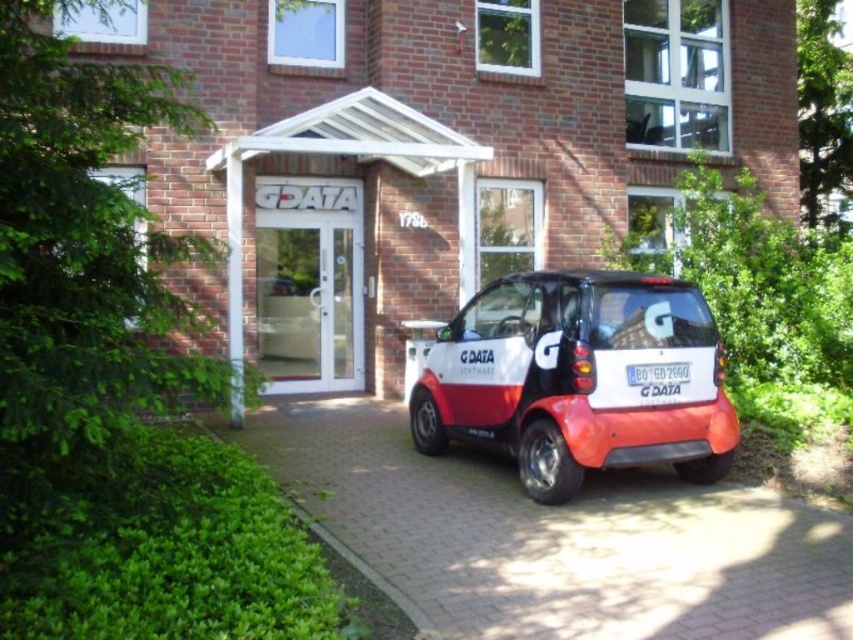
You are a delivery person trying to enter the building. You see the white glass door at center and the white plastic license plate at center. Which one is above the other?

The white glass door at center is positioned over the white plastic license plate at center, meaning the door is above the license plate.

You are a delivery person trying to park your van next to the matte white and red car at center. The van is 5 meters long. The white plastic license plate at center is attached to a pole that is 2 meters away from the car. Can you park your van here without overlapping the license plate pole?

The matte white and red car at center is in front of the white plastic license plate at center, meaning the car is closer to you than the license plate pole. Since the pole is 2 meters behind the car, parking a 5 meter long van next to the car would require at least 5 meters of space. However, the distance between the car and the pole is only 2 meters, so there isn

You are a delivery person with a cart that is 2 meters long. You need to move your cart from the entrance of the building to the matte white and red car at center. Is there enough space between the white glass door at center and the car to maneuver your cart without hitting either?

The distance between the matte white and red car at center and the white glass door at center is 4.35 meters. Since the cart is 2 meters long, there is sufficient space to maneuver without hitting either object.